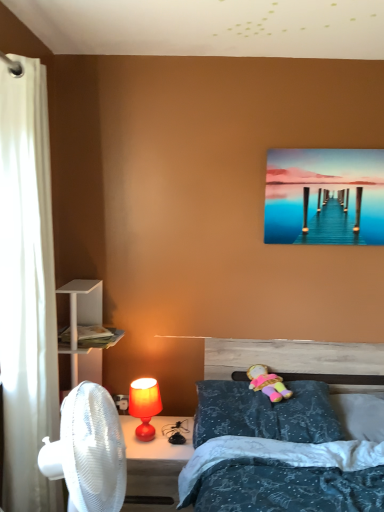
Question: Is matte orange lamp at lower left at the left side of matte red lamp at lower center?

Choices:
 (A) no
 (B) yes

Answer: (B)

Question: Is matte orange lamp at lower left next to matte red lamp at lower center and touching it?

Choices:
 (A) no
 (B) yes

Answer: (A)

Question: Does matte orange lamp at lower left have a smaller size compared to matte red lamp at lower center?

Choices:
 (A) no
 (B) yes

Answer: (B)

Question: Considering the relative sizes of matte orange lamp at lower left and matte red lamp at lower center in the image provided, is matte orange lamp at lower left taller than matte red lamp at lower center?

Choices:
 (A) no
 (B) yes

Answer: (A)

Question: Is matte orange lamp at lower left thinner than matte red lamp at lower center?

Choices:
 (A) no
 (B) yes

Answer: (B)

Question: Considering the relative sizes of matte orange lamp at lower left and matte red lamp at lower center in the image provided, is matte orange lamp at lower left bigger than matte red lamp at lower center?

Choices:
 (A) no
 (B) yes

Answer: (A)

Question: Are blue textured pillow at lower right, which appears as the second pillow when viewed from the left, and white fabric curtain at left located far from each other?

Choices:
 (A) yes
 (B) no

Answer: (A)

Question: From the image's perspective, is blue textured pillow at lower right, which appears as the second pillow when viewed from the left, located above white fabric curtain at left?

Choices:
 (A) no
 (B) yes

Answer: (A)

Question: Is blue textured pillow at lower right, which appears as the second pillow when viewed from the left, shorter than white fabric curtain at left?

Choices:
 (A) yes
 (B) no

Answer: (A)

Question: Can you confirm if blue textured pillow at lower right, the first pillow in the right-to-left sequence, is positioned to the right of white fabric curtain at left?

Choices:
 (A) no
 (B) yes

Answer: (B)

Question: Can you confirm if blue textured pillow at lower right, which appears as the second pillow when viewed from the left, is thinner than white fabric curtain at left?

Choices:
 (A) no
 (B) yes

Answer: (A)

Question: Can you confirm if blue textured pillow at lower right, the first pillow in the right-to-left sequence, is taller than white fabric curtain at left?

Choices:
 (A) yes
 (B) no

Answer: (B)

Question: Is white fabric curtain at left not inside plush fabric doll at center?

Choices:
 (A) no
 (B) yes

Answer: (B)